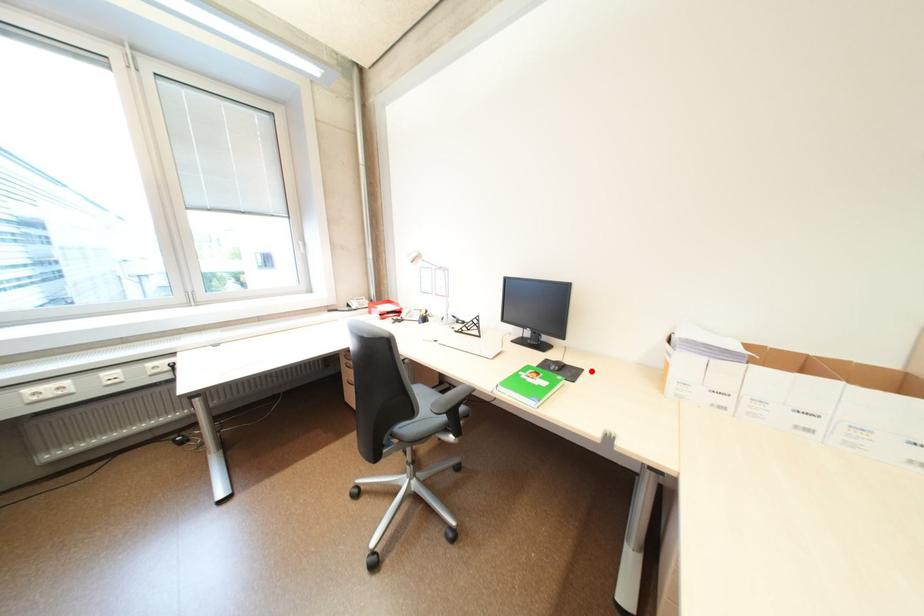
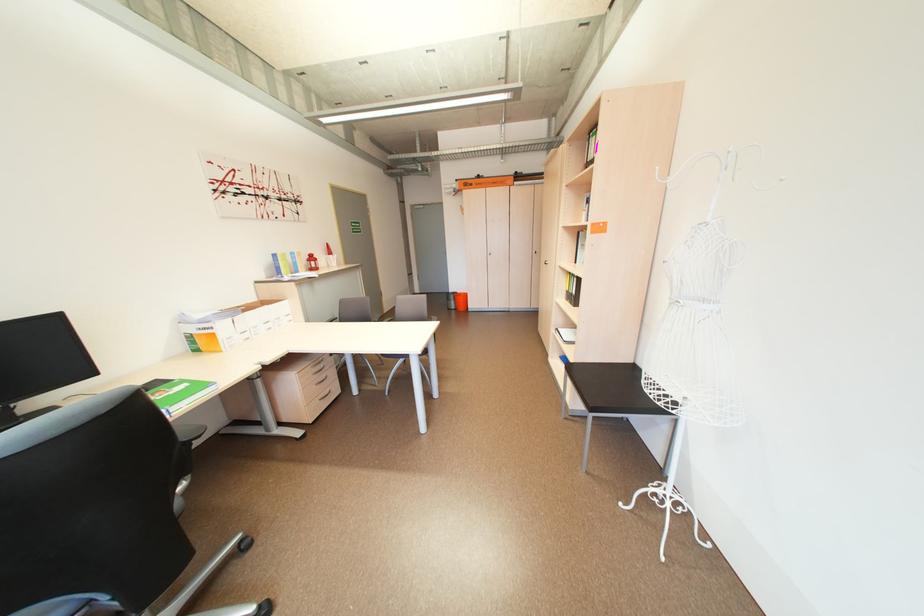
The point at the highlighted location is marked in the first image. Where is the corresponding point in the second image?

(164, 382)